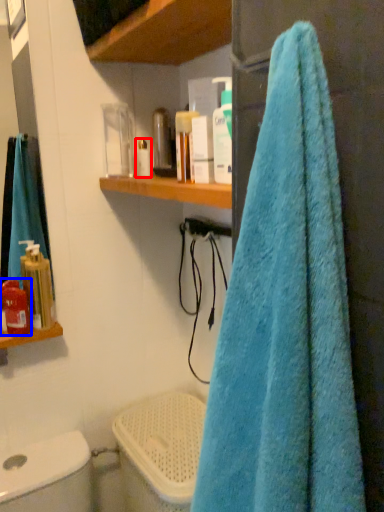
Question: Which point is closer to the camera, toiletry (highlighted by a red box) or toiletry (highlighted by a blue box)?

Choices:
 (A) toiletry
 (B) toiletry

Answer: (B)